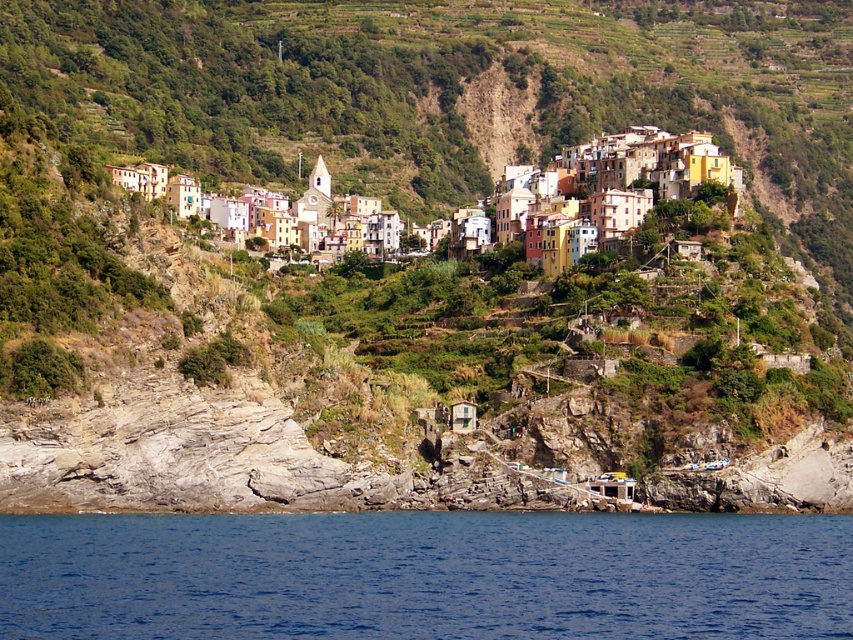
Question: Does blue liquid water at lower center lie in front of multicolored stone buildings at upper center?

Choices:
 (A) yes
 (B) no

Answer: (A)

Question: Observing the image, what is the correct spatial positioning of blue liquid water at lower center in reference to multicolored stone buildings at upper center?

Choices:
 (A) above
 (B) below

Answer: (B)

Question: Which of the following is the farthest from the observer?

Choices:
 (A) multicolored stone buildings at upper center
 (B) blue liquid water at lower center

Answer: (A)

Question: Can you confirm if blue liquid water at lower center is smaller than multicolored stone buildings at upper center?

Choices:
 (A) yes
 (B) no

Answer: (A)